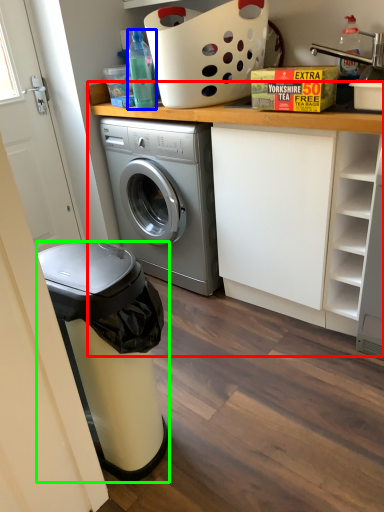
Question: Which is farther away from counter (highlighted by a red box)? bottle (highlighted by a blue box) or dish washer (highlighted by a green box)?

Choices:
 (A) bottle
 (B) dish washer

Answer: (B)